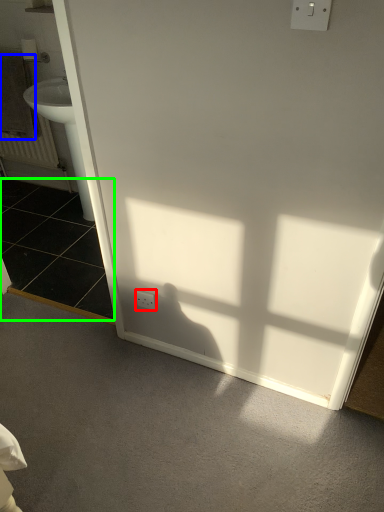
Question: Based on their relative distances, which object is nearer to electric outlet (highlighted by a red box)? Choose from towel/napkin (highlighted by a blue box) and tile (highlighted by a green box).

Choices:
 (A) towel/napkin
 (B) tile

Answer: (B)